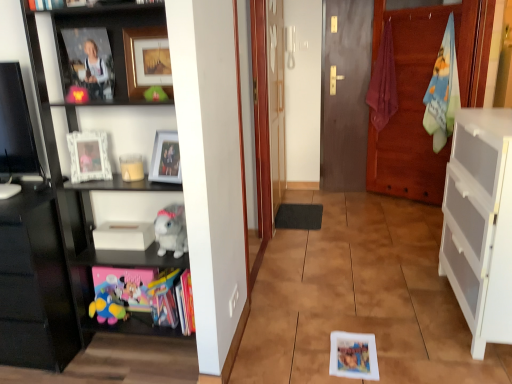
Question: Is soft plush toy at lower left, which ranks as the second toy in right-to-left order, outside of gray plush toy at left?

Choices:
 (A) no
 (B) yes

Answer: (B)

Question: Can you confirm if soft plush toy at lower left, which is counted as the 2th toy, starting from the front, is positioned to the left of gray plush toy at left?

Choices:
 (A) yes
 (B) no

Answer: (A)

Question: Considering the relative sizes of soft plush toy at lower left, which ranks as the second toy in right-to-left order, and gray plush toy at left in the image provided, is soft plush toy at lower left, which ranks as the second toy in right-to-left order, wider than gray plush toy at left?

Choices:
 (A) no
 (B) yes

Answer: (A)

Question: From the image's perspective, is soft plush toy at lower left, which ranks as the second toy in right-to-left order, located above gray plush toy at left?

Choices:
 (A) no
 (B) yes

Answer: (A)

Question: Is gray plush toy at left at the back of soft plush toy at lower left, the first toy ordered from the bottom?

Choices:
 (A) no
 (B) yes

Answer: (A)

Question: In terms of height, does matte glass picture frame at upper center, positioned as the 3th picture frame in top-to-bottom order, look taller or shorter compared to white matte cabinet at right, acting as the 1th cabinetry starting from the right?

Choices:
 (A) tall
 (B) short

Answer: (B)

Question: Is matte glass picture frame at upper center, positioned as the 3th picture frame in top-to-bottom order, inside the boundaries of white matte cabinet at right, acting as the 2th cabinetry starting from the left, or outside?

Choices:
 (A) outside
 (B) inside

Answer: (A)

Question: Looking at their shapes, would you say matte glass picture frame at upper center, positioned as the 3th picture frame in top-to-bottom order, is wider or thinner than white matte cabinet at right, acting as the 2th cabinetry starting from the left?

Choices:
 (A) wide
 (B) thin

Answer: (B)

Question: Looking at the image, does matte glass picture frame at upper center, the 1th picture frame in the bottom-to-top sequence, seem bigger or smaller compared to white matte cabinet at right, acting as the 1th cabinetry starting from the right?

Choices:
 (A) big
 (B) small

Answer: (B)

Question: From a real-world perspective, relative to matte glass picture frame at upper center, positioned as the 3th picture frame in top-to-bottom order, is matte plastic book at lower left, the first book in the right-to-left sequence, vertically above or below?

Choices:
 (A) above
 (B) below

Answer: (B)

Question: Is matte plastic book at lower left, the first book in the right-to-left sequence, spatially inside matte glass picture frame at upper center, positioned as the 3th picture frame in top-to-bottom order, or outside of it?

Choices:
 (A) inside
 (B) outside

Answer: (B)

Question: Is matte plastic book at lower left, the first book in the right-to-left sequence, in front of or behind matte glass picture frame at upper center, the 1th picture frame in the bottom-to-top sequence, in the image?

Choices:
 (A) front
 (B) behind

Answer: (B)

Question: From the image's perspective, is matte plastic book at lower left, placed as the 3th book when sorted from top to bottom, positioned above or below matte glass picture frame at upper center, positioned as the 3th picture frame in top-to-bottom order?

Choices:
 (A) above
 (B) below

Answer: (B)

Question: From their relative heights in the image, would you say gray plush toy at left is taller or shorter than white glossy picture frame at upper left, arranged as the 2th picture frame when viewed from the top?

Choices:
 (A) tall
 (B) short

Answer: (B)

Question: From a real-world perspective, is gray plush toy at left physically located above or below white glossy picture frame at upper left, placed as the second picture frame when sorted from bottom to top?

Choices:
 (A) above
 (B) below

Answer: (B)